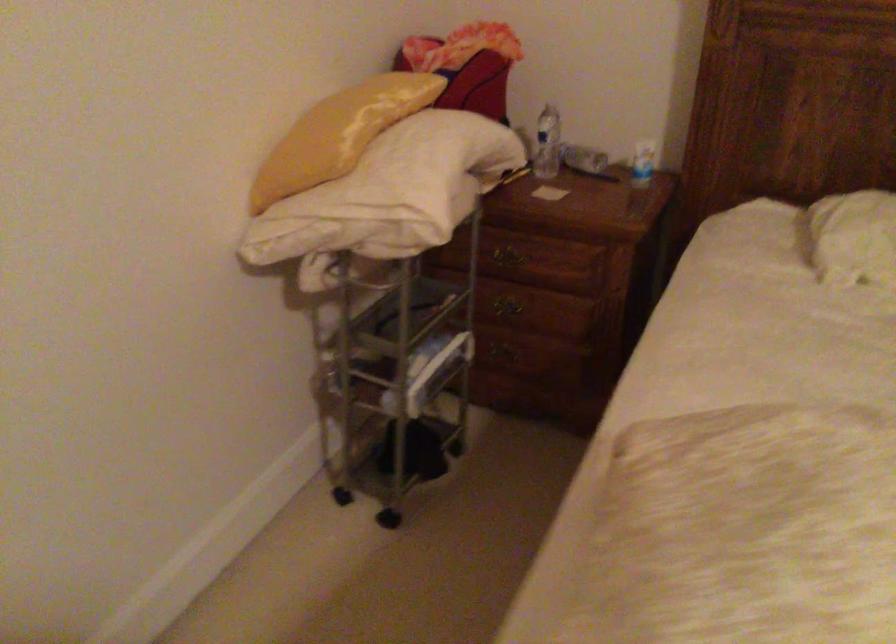
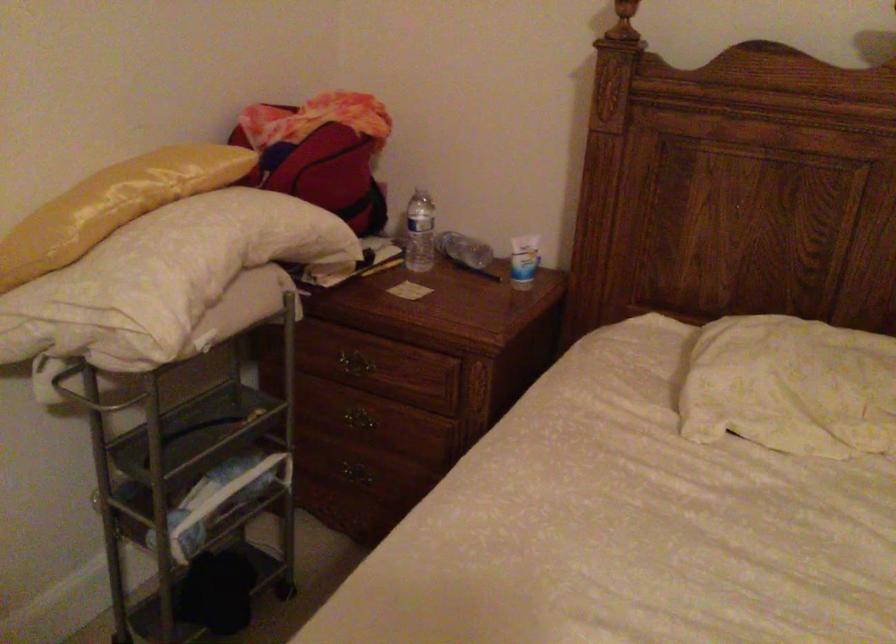
In the second image, find the point that corresponds to [424,184] in the first image.

(164, 278)